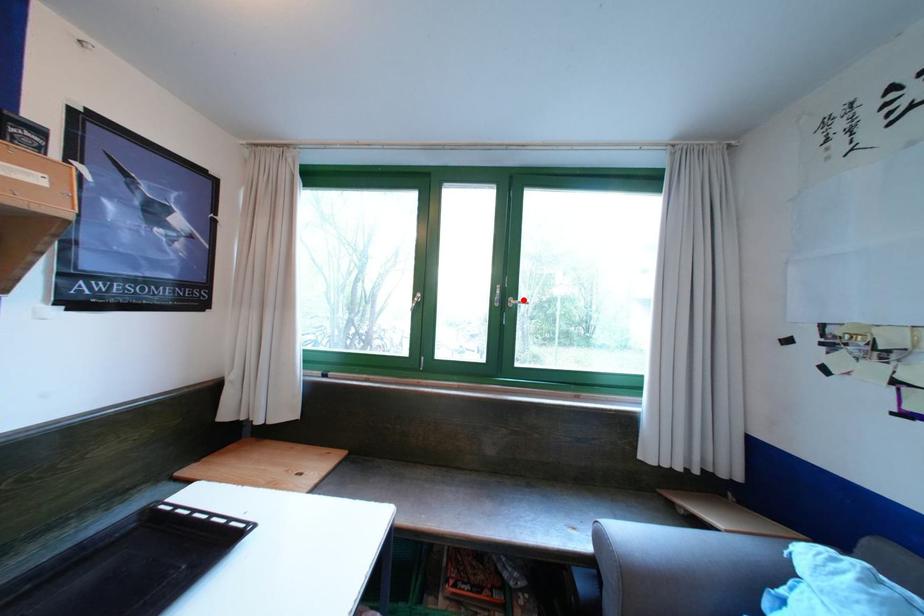
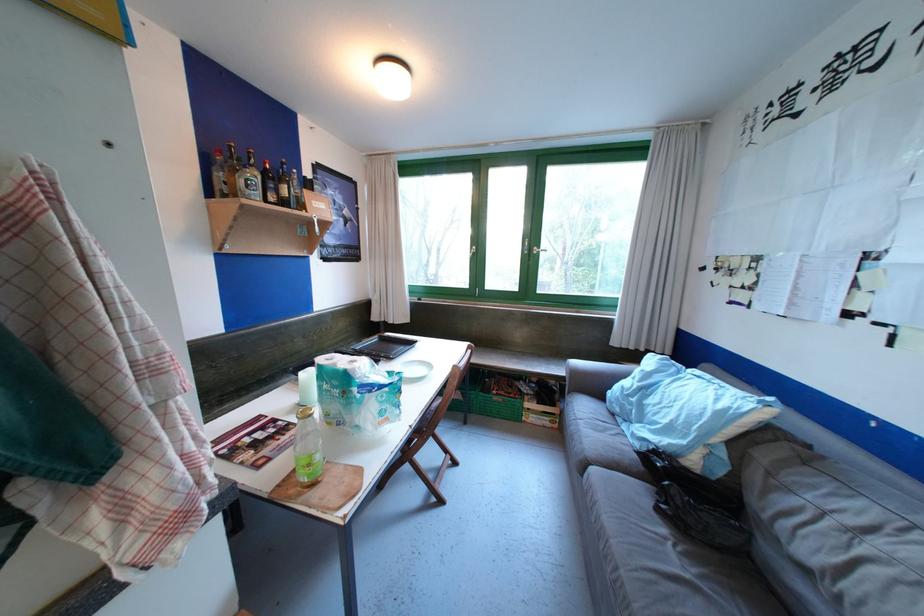
Where in the second image is the point corresponding to the highlighted location from the first image?

(545, 249)